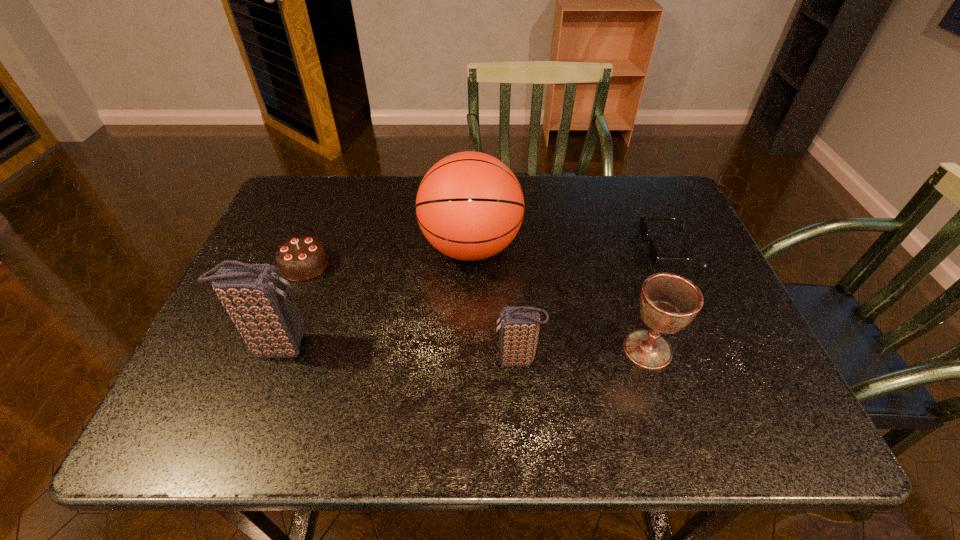
Find the location of a particular element. The image size is (960, 540). vacant point located 0.360m with the zip open on the right clutch bag is located at coordinates (323, 360).

What are the coordinates of `vacant space located 0.180m on the front-facing side of the rightmost object` in the screenshot? It's located at (574, 249).

This screenshot has height=540, width=960. I want to click on vacant space located 0.150m on the front-facing side of the rightmost object, so click(586, 249).

In order to click on vacant position located 0.190m on the front-facing side of the rightmost object in this screenshot , I will do `click(570, 249)`.

Locate an element on the screen. This screenshot has height=540, width=960. free space located 0.270m on the right of the chocolate cake is located at coordinates (434, 265).

You are a GUI agent. You are given a task and a screenshot of the screen. Output one action in this format:
    pyautogui.click(x=<x>, y=<y>)
    Task: Click on the blank area located on the right of the basketball
    
    Given the screenshot: What is the action you would take?
    pyautogui.click(x=600, y=247)

Where is `blank area located 0.070m on the left of the chalice`? The width and height of the screenshot is (960, 540). blank area located 0.070m on the left of the chalice is located at coordinates (589, 349).

Identify the location of object at the far edge. (470, 206).

Identify the location of chalice present at the near edge. [668, 302].

Locate an element on the screen. The image size is (960, 540). clutch bag present at the left edge is located at coordinates (256, 296).